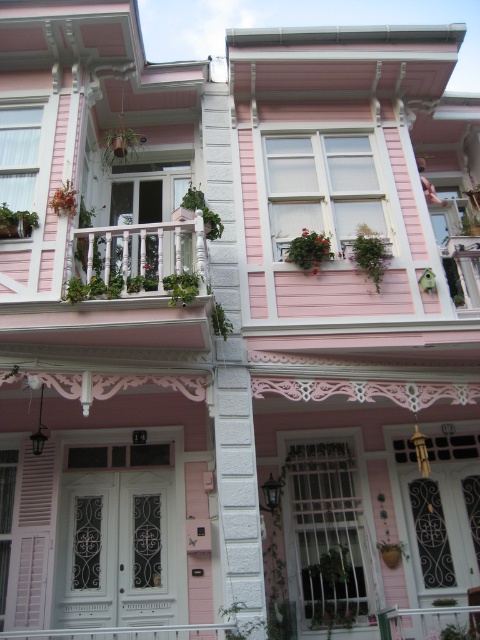
The width and height of the screenshot is (480, 640). What are the coordinates of `pink matte shutter at lower left` in the screenshot? It's located at (29, 538).

Does point (26, 499) lie in front of point (215, 625)?

No.

Find the location of `pink matte shutter at lower left`. pink matte shutter at lower left is located at coordinates (29, 538).

Describe the element at coordinates (122, 291) in the screenshot. I see `white wooden balcony at center` at that location.

You are a GUI agent. You are given a task and a screenshot of the screen. Output one action in this format:
    pyautogui.click(x=<x>, y=<y>)
    Task: Click on the white wooden balcony at center
    This screenshot has width=480, height=640.
    Given the screenshot: What is the action you would take?
    pyautogui.click(x=122, y=291)

Image resolution: width=480 pixels, height=640 pixels. I want to click on white wooden balcony at center, so click(122, 291).

Who is positioned more to the left, white wooden balcony at center or white painted wood porch at lower center?

white painted wood porch at lower center

Can you confirm if white wooden balcony at center is thinner than white painted wood porch at lower center?

In fact, white wooden balcony at center might be wider than white painted wood porch at lower center.

Between point (67, 294) and point (148, 636), which one is positioned in front?

Point (67, 294)

I want to click on white wooden balcony at center, so click(122, 291).